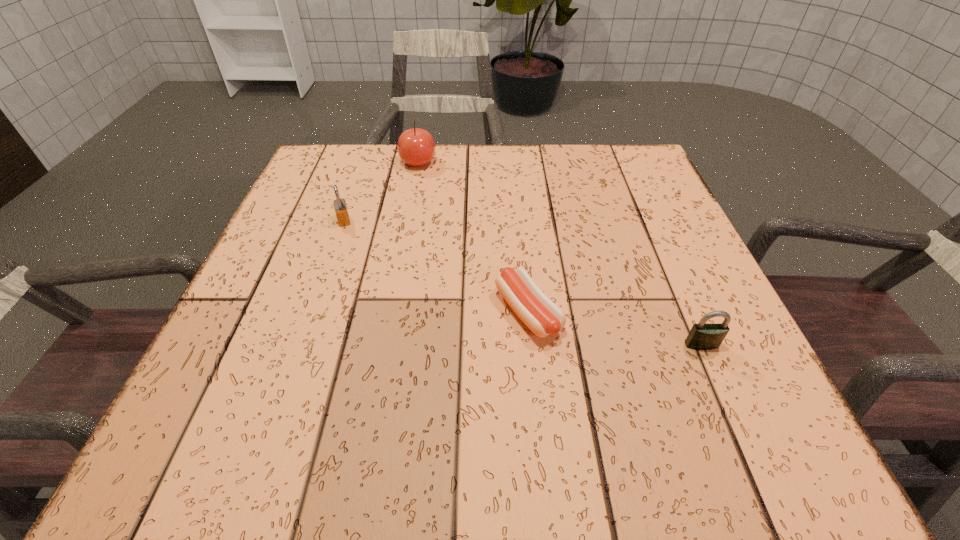
Where is `free space located 0.140m on the left of the rightmost object`? free space located 0.140m on the left of the rightmost object is located at coordinates (603, 345).

Identify the location of vacant space situated 0.180m on the front of the shortest object. (541, 451).

This screenshot has width=960, height=540. Identify the location of object positioned at the far edge. (416, 147).

Find the location of `object at the left edge`. object at the left edge is located at coordinates (341, 211).

This screenshot has width=960, height=540. Identify the location of object at the right edge. (703, 336).

The width and height of the screenshot is (960, 540). In the image, there is a desktop. Find the location of `vacant space at the far edge`. vacant space at the far edge is located at coordinates (588, 186).

Where is `vacant space at the near edge of the desktop`? vacant space at the near edge of the desktop is located at coordinates pyautogui.click(x=553, y=464).

Where is `vacant space at the left edge`? vacant space at the left edge is located at coordinates (304, 264).

I want to click on free space at the right edge, so click(706, 380).

At what (x,y) coordinates should I click in order to perform the action: click on empty space between the sausage and the right padlock. Please return your answer as a coordinate pair (x, y). Looking at the image, I should click on (614, 328).